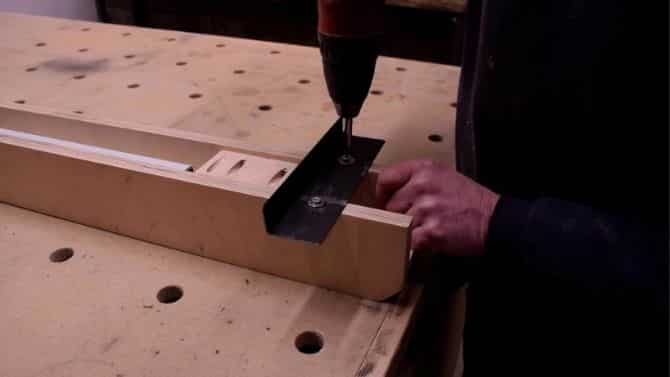
Locate an element on the screen. The width and height of the screenshot is (670, 377). wooden base is located at coordinates (258, 319).